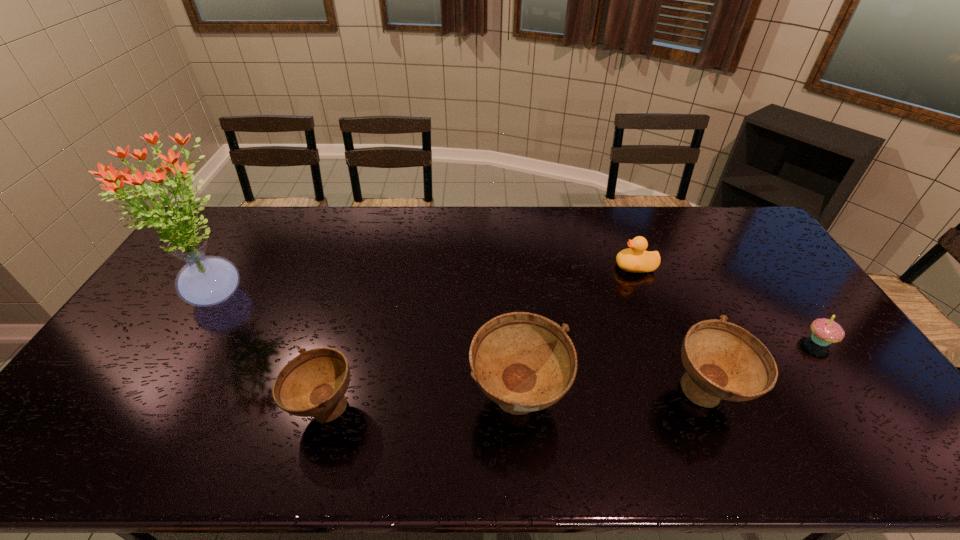
Identify the location of free space at the near edge of the desktop. The height and width of the screenshot is (540, 960). (697, 419).

Identify the location of free space at the left edge. (169, 274).

At what (x,y) coordinates should I click in order to perform the action: click on vacant space at the right edge of the desktop. Please return your answer as a coordinate pair (x, y). This screenshot has height=540, width=960. Looking at the image, I should click on (749, 284).

The width and height of the screenshot is (960, 540). What are the coordinates of `vacant area that lies between the leftmost object and the second soup bowl from left to right` in the screenshot? It's located at (370, 349).

Identify the location of free space that is in between the third tallest object and the flower arrangement. The image size is (960, 540). tap(464, 346).

At what (x,y) coordinates should I click in order to perform the action: click on free space between the fourth shortest object and the duck. Please return your answer as a coordinate pair (x, y). Looking at the image, I should click on (671, 330).

Image resolution: width=960 pixels, height=540 pixels. In order to click on vacant space in between the tallest object and the leftmost soup bowl in this screenshot , I will do `click(273, 353)`.

Locate an element on the screen. free spot between the third object from left to right and the shortest soup bowl is located at coordinates coord(421,406).

Locate an element on the screen. vacant space that's between the cupcake and the fourth object from right to left is located at coordinates (669, 371).

Image resolution: width=960 pixels, height=540 pixels. What are the coordinates of `vacant space that's between the second soup bowl from right to left and the flower arrangement` in the screenshot? It's located at (370, 349).